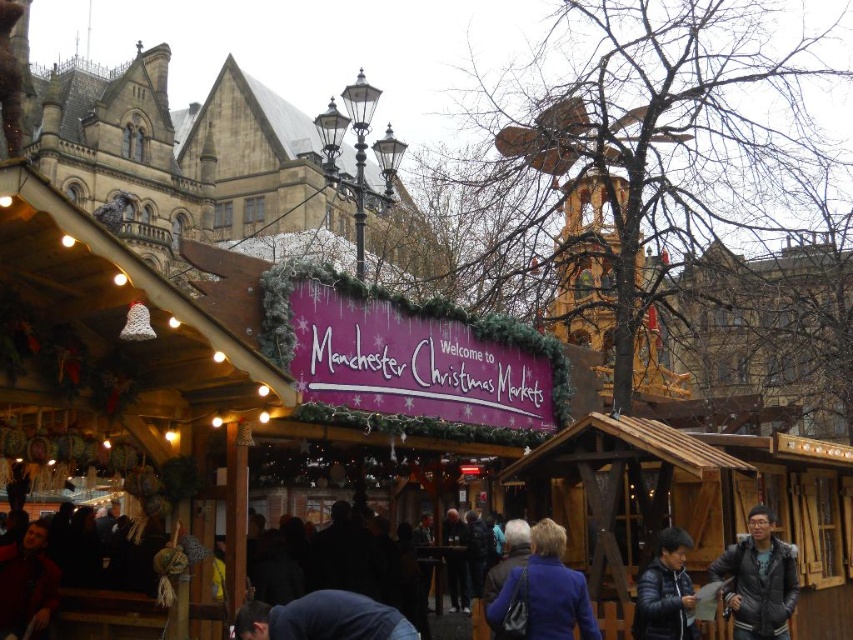
You are a visitor at the Manchester Christmas Markets and you see a blue fabric at lower center and a black leather jacket at lower center. Which item is located to the left when viewed from your perspective?

The blue fabric at lower center is positioned on the left side of the black leather jacket at lower center, so it is located to the left when viewed from your perspective.

You are a customer at the Manchester Christmas Markets and want to decide which item to purchase first. You see a dark gray puffer jacket at lower right and a blue fabric at lower center. Which item is taller?

The dark gray puffer jacket at lower right is taller than the blue fabric at lower center.

You are a visitor at the Manchester Christmas Markets and want to take a photo of both the purple banner and the snowflake ornaments. The purple banner is located at point (749, 588) and the snowflake ornaments are at point (300, 614). Since you want to include both in your photo, which object should you position closer to the camera to ensure both are visible?

Point (749, 588) is behind point (300, 614), so you should position the snowflake ornaments at point (300, 614) closer to the camera to ensure both the purple banner and the snowflake ornaments are visible in the photo.